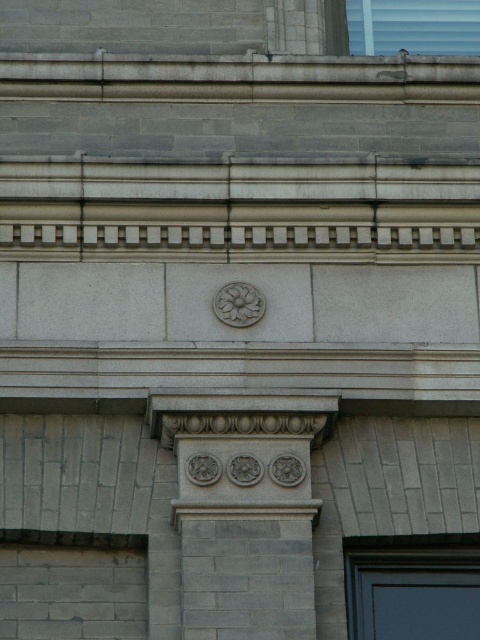
How much distance is there between gray stone column at center and carved stone flower at center?

gray stone column at center and carved stone flower at center are 22.77 feet apart.

Between gray stone column at center and carved stone flower at center, which one appears on the right side from the viewer's perspective?

gray stone column at center

Where is `gray stone column at center`? gray stone column at center is located at coordinates pos(243,509).